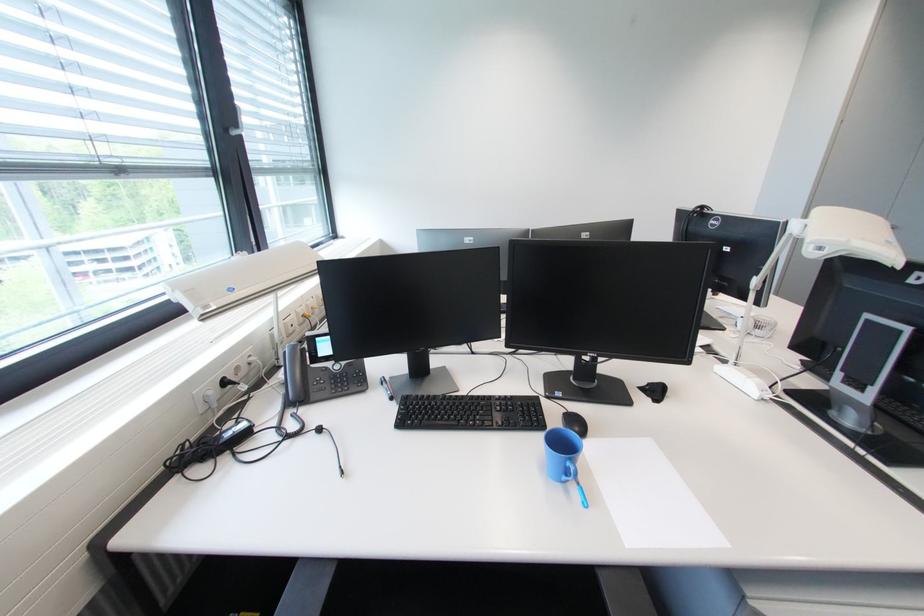
Locate an element on the screen. phone keypad button is located at coordinates (468, 411).